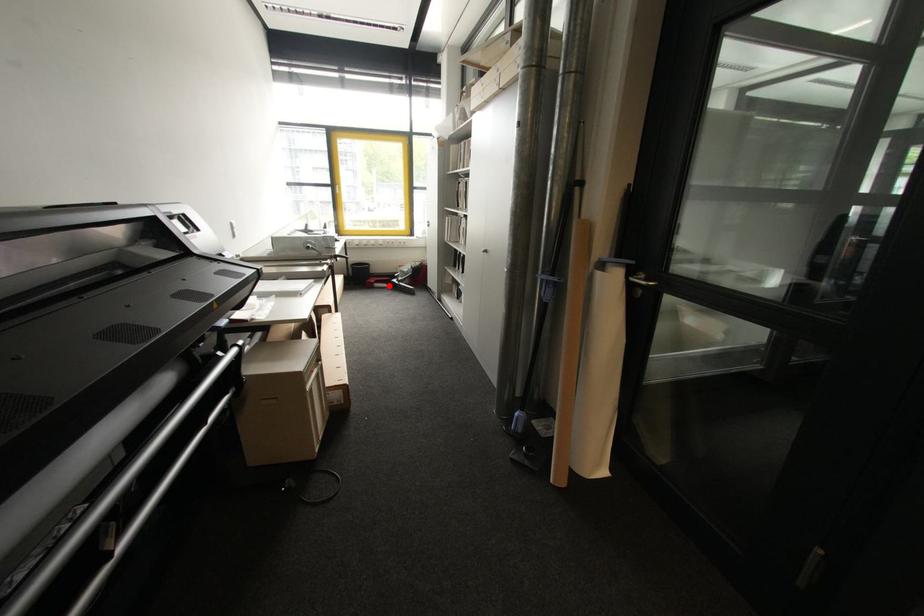
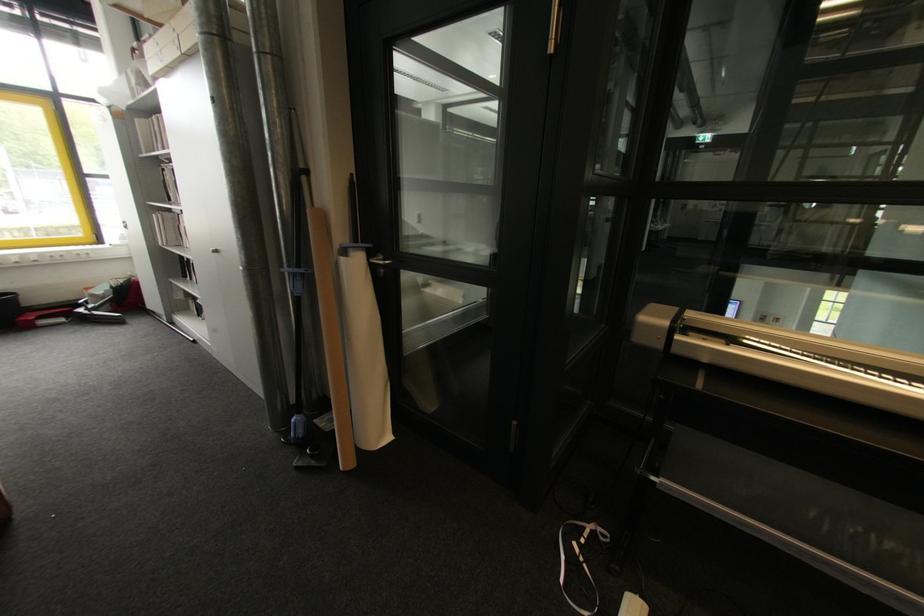
Question: A red point is marked in image1. In image2, is the corresponding 3D point closer to the camera or farther? Reply with the corresponding letter.

Choices:
 (A) The corresponding 3D point is closer.
 (B) The corresponding 3D point is farther.

Answer: (B)